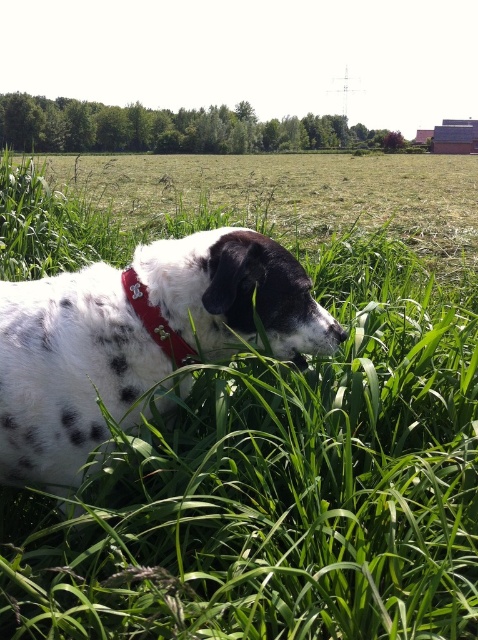
Question: Which of the following is the farthest from the observer?

Choices:
 (A) (13, 438)
 (B) (152, 316)

Answer: (B)

Question: Does spotted fur dog at lower left appear over red fabric neckband at center?

Choices:
 (A) yes
 (B) no

Answer: (B)

Question: Which of the following is the farthest from the observer?

Choices:
 (A) red fabric neckband at center
 (B) spotted fur dog at lower left

Answer: (A)

Question: Can you confirm if spotted fur dog at lower left is positioned to the right of red fabric neckband at center?

Choices:
 (A) no
 (B) yes

Answer: (A)

Question: Can you confirm if spotted fur dog at lower left is positioned to the right of red fabric neckband at center?

Choices:
 (A) yes
 (B) no

Answer: (B)